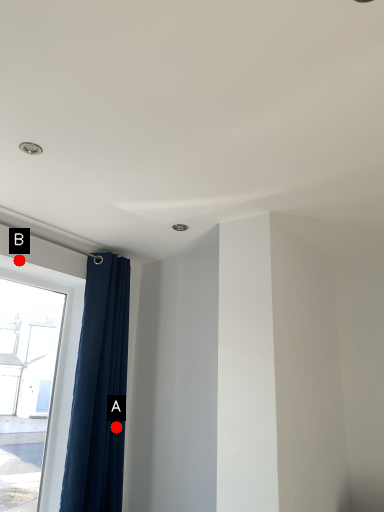
Question: Two points are circled on the image, labeled by A and B beside each circle. Which point is closer to the camera?

Choices:
 (A) A is closer
 (B) B is closer

Answer: (B)